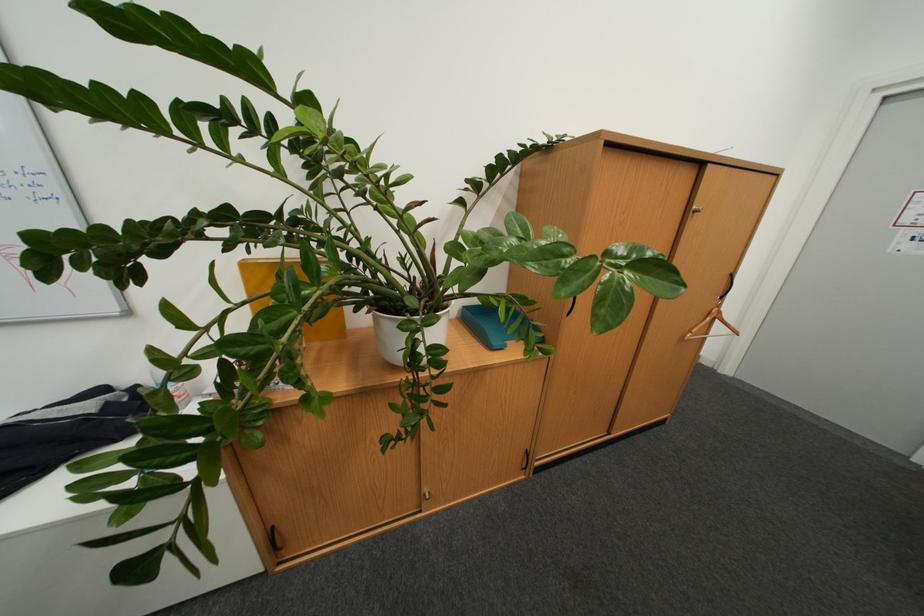
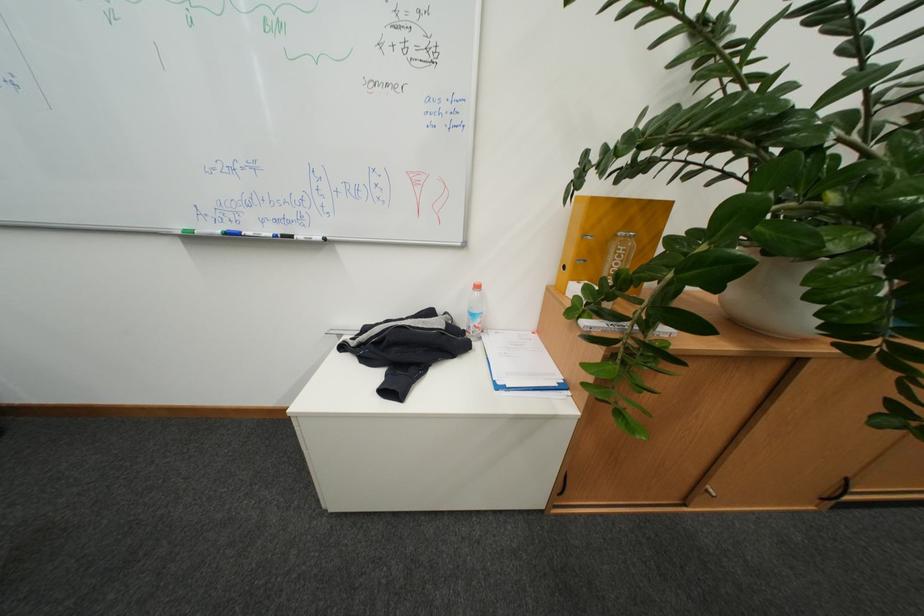
Question: Which direction would the cameraman need to move to produce the second image? Reply with the corresponding letter.

Choices:
 (A) Left
 (B) Right
 (C) Forward
 (D) Backward

Answer: (A)